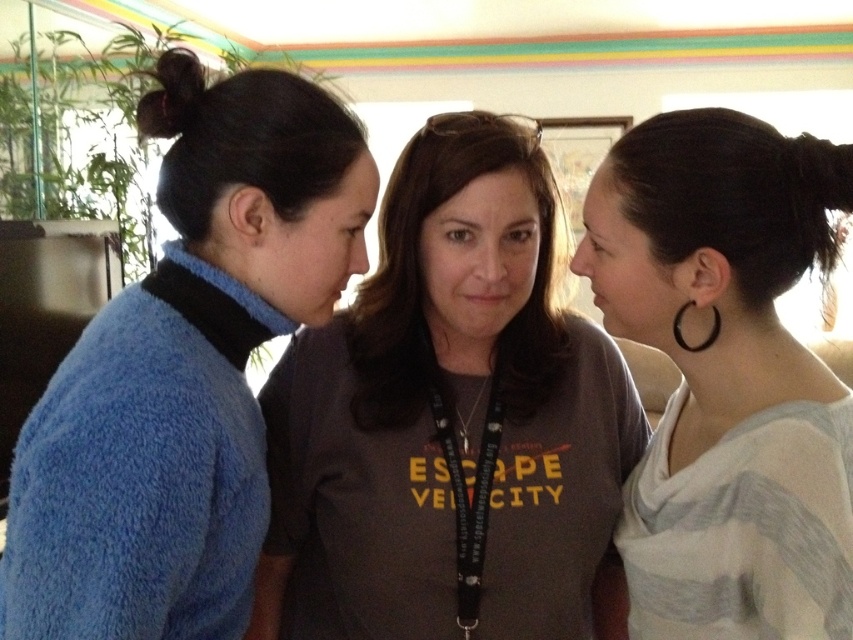
Looking at this image, you are standing in a room where three people are talking. You notice a point marked at coordinates (447, 416). Which person is located at that point?

The point at (447, 416) marks the dark gray t shirt at center.